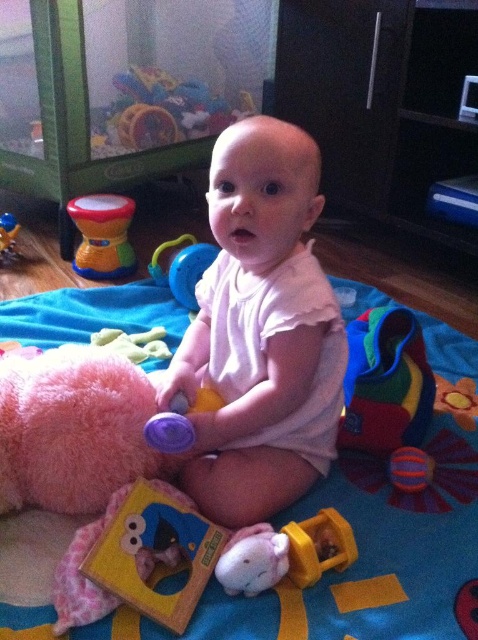
You are a parent trying to place a new toy for your baby. The baby is currently sitting at point (386, 381). You want to place the new toy so that it is directly to the baby. Which direction should you place the new toy?

The multicolored fabric toy at center is located at point (386, 381). To place the new toy directly to the baby, you should place it in the same location as the baby, which is at point (386, 381).

You are a parent trying to organize the baby toys. You need to place the rainbow plastic drum at center and the white plush toy at center into a storage box. Which toy will take up more vertical space in the box?

The rainbow plastic drum at center is much taller than the white plush toy at center, so it will take up more vertical space in the storage box.

You are a photographer taking a picture of the baby. You notice two points in the image labeled as point 1 and point 2. If point 1 is at coordinate point (80,232) and point 2 is at coordinate point (249,532), which point is closer to your camera?

Point 1 at coordinate point (80,232) is closer to the camera than point 2 at coordinate point (249,532) because it is further to the camera.